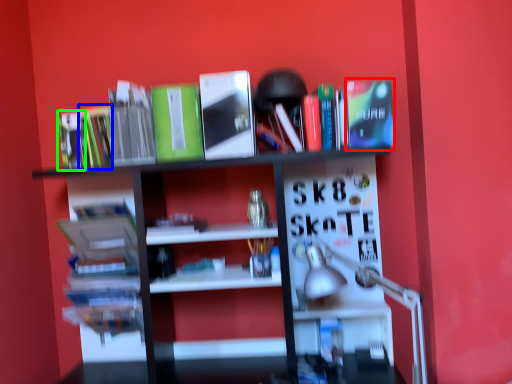
Question: Estimate the real-world distances between objects in this image. Which object is closer to paperback book (highlighted by a red box), book (highlighted by a blue box) or book (highlighted by a green box)?

Choices:
 (A) book
 (B) book

Answer: (A)